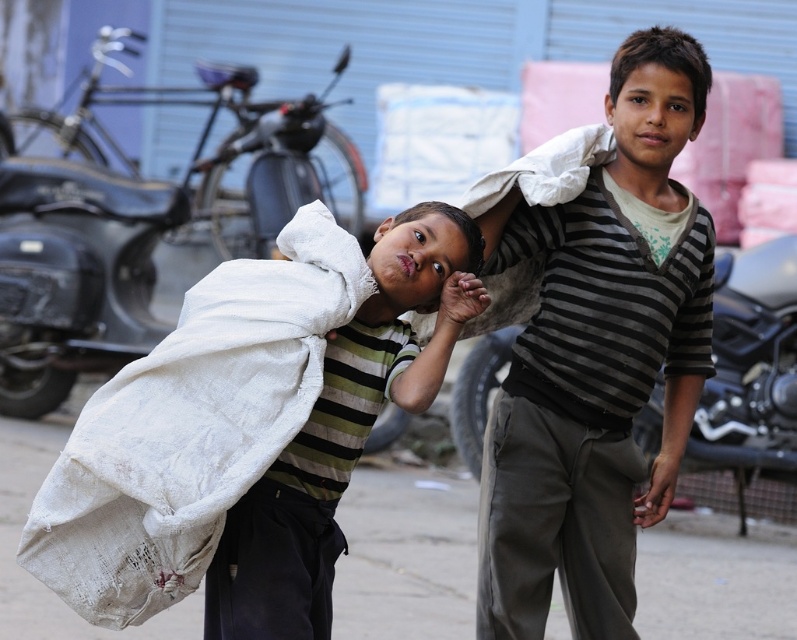
Question: Based on their relative distances, which object is nearer to the white fabric sack at center?

Choices:
 (A) white woven sack at center
 (B) white fabric bag at center

Answer: (A)

Question: Which object is the farthest from the white fabric sack at center?

Choices:
 (A) white woven sack at center
 (B) black matte motorcycle at center

Answer: (B)

Question: In this image, where is white fabric bag at center located relative to white woven sack at center?

Choices:
 (A) below
 (B) above

Answer: (B)

Question: Can you confirm if white fabric bag at center is smaller than white woven sack at center?

Choices:
 (A) yes
 (B) no

Answer: (A)

Question: Which of these objects is positioned closest to the white fabric bag at center?

Choices:
 (A) black matte motorcycle at center
 (B) white fabric sack at center

Answer: (B)

Question: Can you confirm if white fabric bag at center is positioned to the right of white woven sack at center?

Choices:
 (A) no
 (B) yes

Answer: (B)